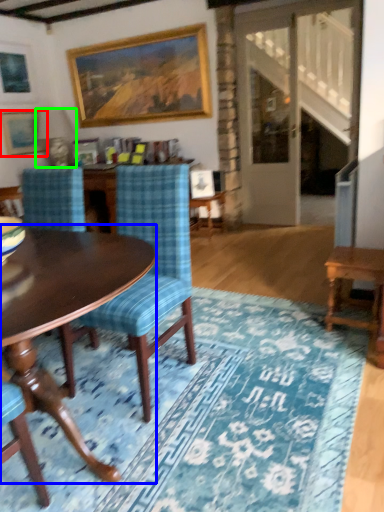
Question: Which is farther away from picture frame (highlighted by a red box)? coffee table (highlighted by a blue box) or lamp (highlighted by a green box)?

Choices:
 (A) coffee table
 (B) lamp

Answer: (A)